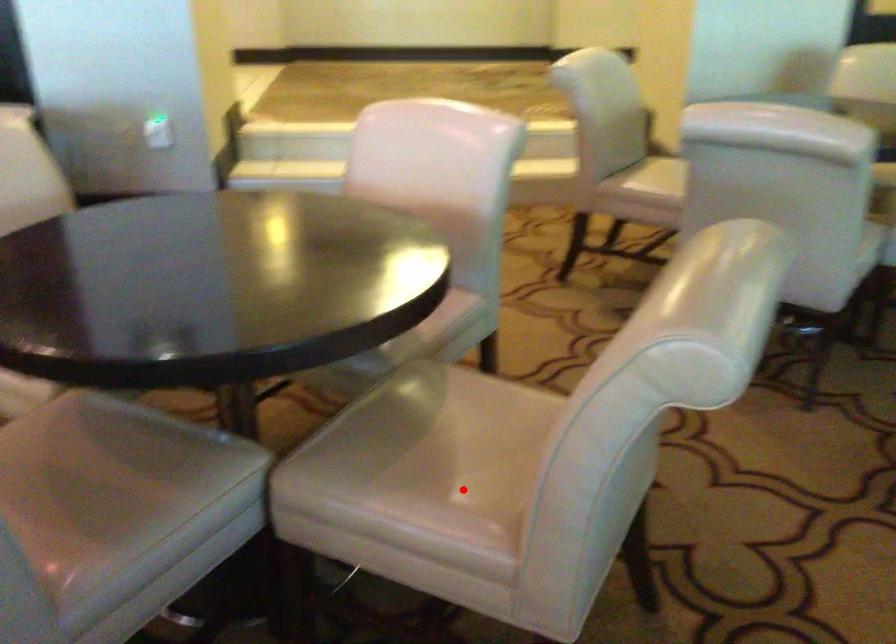
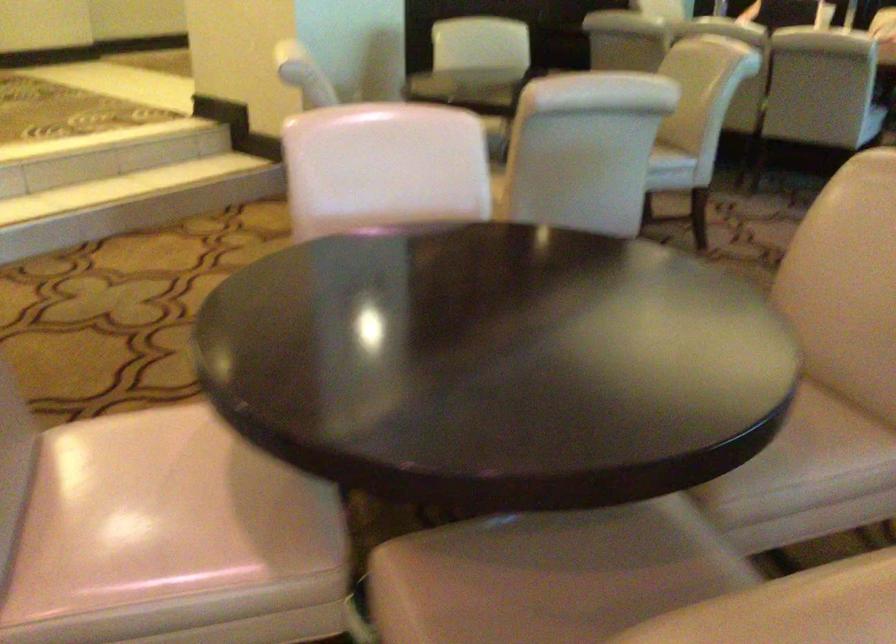
The point at the highlighted location is marked in the first image. Where is the corresponding point in the second image?

(814, 424)